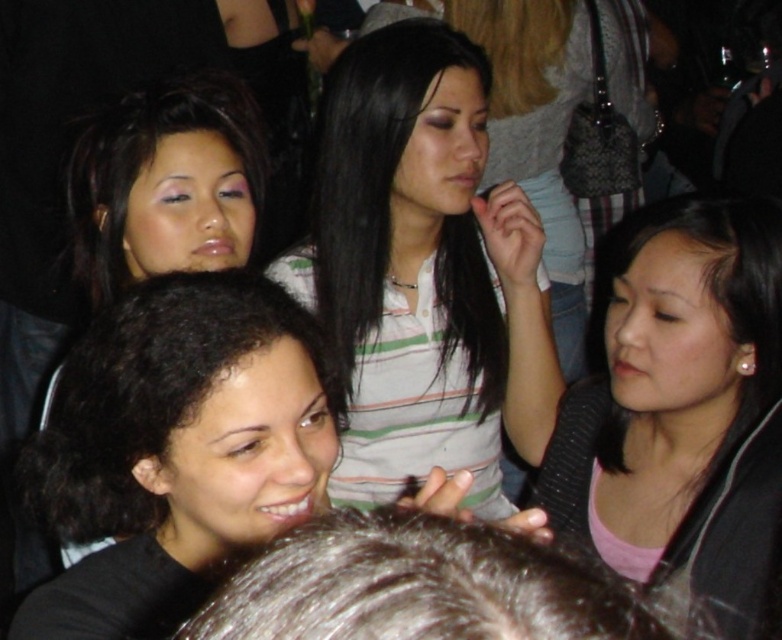
Can you confirm if black curly hair at lower left is positioned below dark brown hair at lower center?

Actually, black curly hair at lower left is above dark brown hair at lower center.

Is black curly hair at lower left thinner than dark brown hair at lower center?

No.

Does point (34, 500) lie in front of point (482, 620)?

No, (34, 500) is behind (482, 620).

Where is `black curly hair at lower left`? black curly hair at lower left is located at coordinates (174, 449).

The image size is (782, 640). What do you see at coordinates (668, 376) in the screenshot? I see `pink matte sweater at lower right` at bounding box center [668, 376].

Can you confirm if pink matte sweater at lower right is thinner than dark brown hair at lower center?

No.

Describe the element at coordinates (668, 376) in the screenshot. This screenshot has width=782, height=640. I see `pink matte sweater at lower right` at that location.

Where is `pink matte sweater at lower right`? The image size is (782, 640). pink matte sweater at lower right is located at coordinates (668, 376).

Does point (644, 477) lie in front of point (246, 177)?

No, (644, 477) is behind (246, 177).

Can you confirm if pink matte sweater at lower right is positioned below matte black hair at upper left?

Yes.

Is point (698, 524) farther from camera compared to point (142, 115)?

That is False.

You are a GUI agent. You are given a task and a screenshot of the screen. Output one action in this format:
    pyautogui.click(x=<x>, y=<y>)
    Task: Click on the pink matte sweater at lower right
    This screenshot has width=782, height=640.
    Given the screenshot: What is the action you would take?
    pyautogui.click(x=668, y=376)